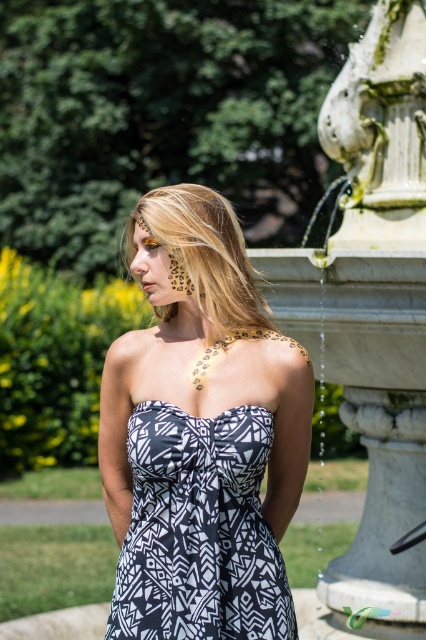
Is black and white printed dress at center wider than leopard print skin at center?

Correct, the width of black and white printed dress at center exceeds that of leopard print skin at center.

Does black and white printed dress at center lie behind leopard print skin at center?

No, it is not.

Does point (155, 509) come behind point (236, 336)?

No, it is not.

Where is `black and white printed dress at center`? Image resolution: width=426 pixels, height=640 pixels. black and white printed dress at center is located at coordinates (198, 531).

How much distance is there between white marble fountain at right and blonde hair at center?

white marble fountain at right is 10.50 feet away from blonde hair at center.

Where is `white marble fountain at right`? The width and height of the screenshot is (426, 640). white marble fountain at right is located at coordinates (371, 314).

Does white marble fountain at right have a lesser height compared to leopard print skin at center?

No, white marble fountain at right is not shorter than leopard print skin at center.

Is white marble fountain at right taller than leopard print skin at center?

Correct, white marble fountain at right is much taller as leopard print skin at center.

Between point (340, 74) and point (262, 333), which one is positioned in front?

Positioned in front is point (262, 333).

The height and width of the screenshot is (640, 426). In order to click on white marble fountain at right in this screenshot , I will do `click(371, 314)`.